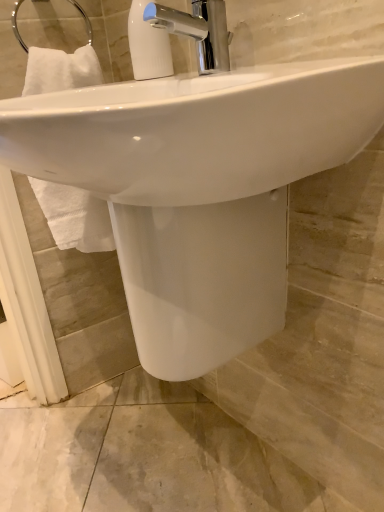
Question: From their relative heights in the image, would you say chrome metallic faucet at upper center is taller or shorter than white glossy sink at center?

Choices:
 (A) tall
 (B) short

Answer: (B)

Question: Based on their positions, is chrome metallic faucet at upper center located to the left or right of white glossy sink at center?

Choices:
 (A) left
 (B) right

Answer: (B)

Question: Estimate the real-world distances between objects in this image. Which object is closer to the chrome metallic faucet at upper center?

Choices:
 (A) white glossy sink at center
 (B) white plastic soap dispenser at upper center

Answer: (B)

Question: Which object is positioned closest to the white glossy sink at center?

Choices:
 (A) chrome metallic faucet at upper center
 (B) white plastic soap dispenser at upper center

Answer: (A)